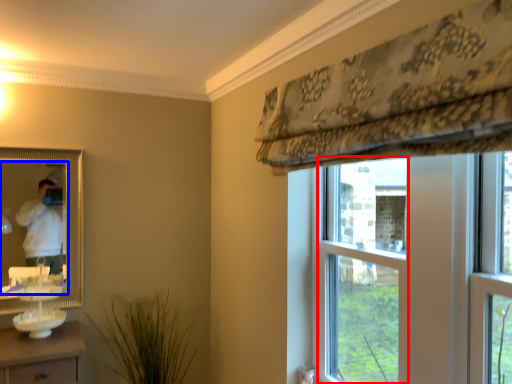
Question: Among these objects, which one is farthest to the camera, bay window (highlighted by a red box) or mirror (highlighted by a blue box)?

Choices:
 (A) bay window
 (B) mirror

Answer: (B)